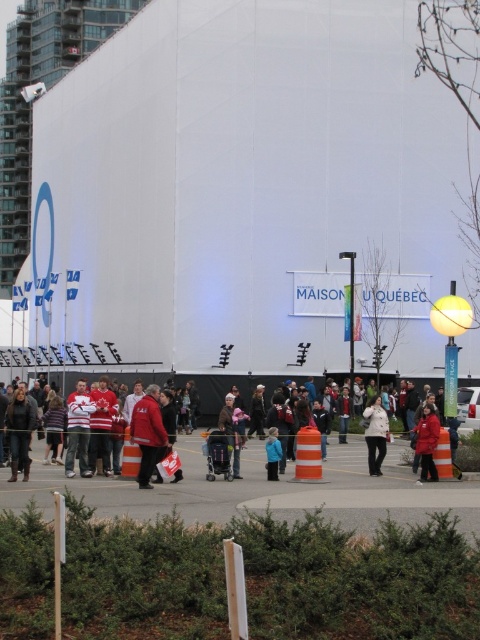
Is white matte jacket at center taller than orange reflective cone at lower right?

Indeed, white matte jacket at center has a greater height compared to orange reflective cone at lower right.

Does point (373, 470) come behind point (436, 458)?

Yes.

The width and height of the screenshot is (480, 640). I want to click on white matte jacket at center, so click(x=375, y=435).

Does red fleece jacket at center appear under dark brown leather jacket at lower left?

Actually, red fleece jacket at center is above dark brown leather jacket at lower left.

Who is higher up, red fleece jacket at center or dark brown leather jacket at lower left?

red fleece jacket at center

Does point (164, 449) lie in front of point (20, 433)?

Yes.

This screenshot has width=480, height=640. I want to click on red fleece jacket at center, so click(147, 433).

Does red jacket at center come in front of orange reflective traffic cone at center?

No.

The height and width of the screenshot is (640, 480). In order to click on red jacket at center in this screenshot , I will do `click(215, 394)`.